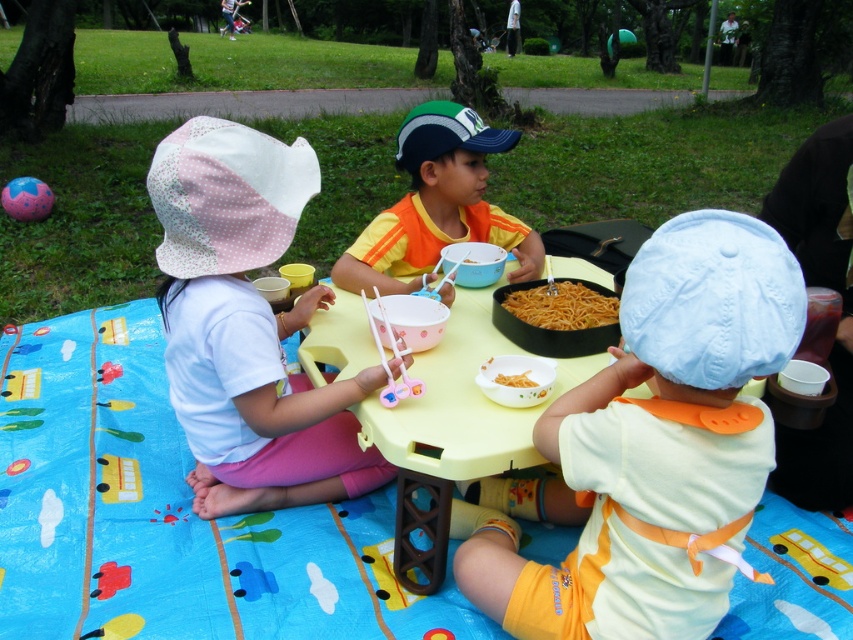
Question: Which point appears farthest from the camera in this image?

Choices:
 (A) (732, 417)
 (B) (383, 552)

Answer: (B)

Question: Which object appears farthest from the camera in this image?

Choices:
 (A) yellow plastic table at center
 (B) white polka dot fabric hat at left

Answer: (B)

Question: Which point appears closest to the camera in this image?

Choices:
 (A) (512, 384)
 (B) (412, 522)

Answer: (A)

Question: Does orange fabric shirt at center appear under brown matte noodles at center?

Choices:
 (A) yes
 (B) no

Answer: (B)

Question: Does blue fabric picnic blanket at center have a lesser width compared to white polka dot fabric hat at left?

Choices:
 (A) yes
 (B) no

Answer: (B)

Question: Does blue fabric picnic blanket at center appear on the right side of white fabric bib at center?

Choices:
 (A) yes
 (B) no

Answer: (B)